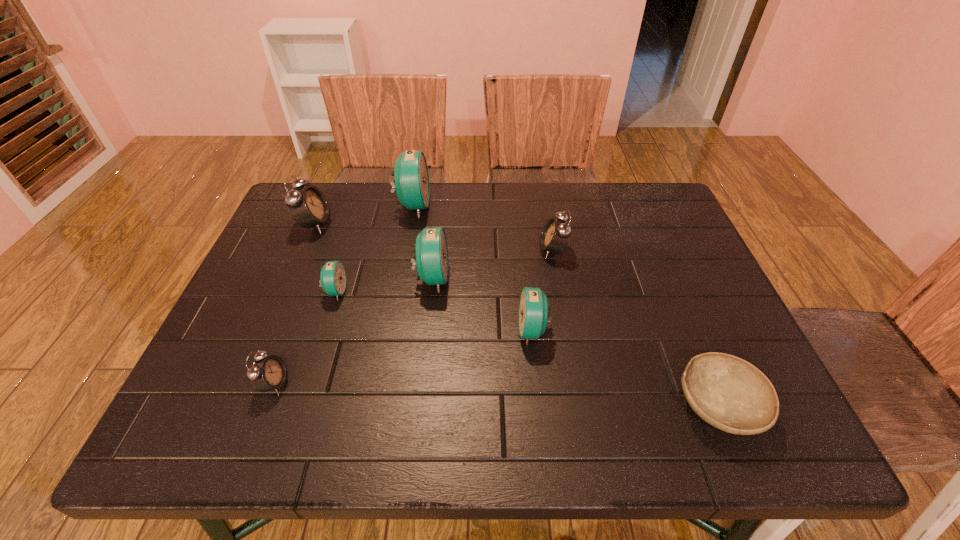
Image resolution: width=960 pixels, height=540 pixels. Find the location of `empty space between the gray bowl and the second biggest blue alarm clock`. empty space between the gray bowl and the second biggest blue alarm clock is located at coordinates (575, 342).

The width and height of the screenshot is (960, 540). I want to click on free space between the farthest white alarm clock and the second biggest blue alarm clock, so click(373, 251).

Where is `empty location between the nearest white alarm clock and the second alarm clock from right to left`? The image size is (960, 540). empty location between the nearest white alarm clock and the second alarm clock from right to left is located at coordinates (404, 357).

Locate an element on the screen. The height and width of the screenshot is (540, 960). vacant region between the rightmost alarm clock and the second nearest alarm clock is located at coordinates (542, 290).

The image size is (960, 540). In order to click on object that can be found as the third closest to the nearest alarm clock in this screenshot , I will do `click(308, 206)`.

Identify which object is the closest to the smallest white alarm clock. Please provide its 2D coordinates. Your answer should be formatted as a tuple, i.e. [(x, y)], where the tuple contains the x and y coordinates of a point satisfying the conditions above.

[(333, 280)]

Select which alarm clock appears as the fifth closest to the rightmost white alarm clock. Please provide its 2D coordinates. Your answer should be formatted as a tuple, i.e. [(x, y)], where the tuple contains the x and y coordinates of a point satisfying the conditions above.

[(308, 206)]

Identify which alarm clock is the fifth nearest to the third smallest blue alarm clock. Please provide its 2D coordinates. Your answer should be formatted as a tuple, i.e. [(x, y)], where the tuple contains the x and y coordinates of a point satisfying the conditions above.

[(308, 206)]

Locate which blue alarm clock is the second closest to the nearest white alarm clock. Please provide its 2D coordinates. Your answer should be formatted as a tuple, i.e. [(x, y)], where the tuple contains the x and y coordinates of a point satisfying the conditions above.

[(431, 251)]

Identify the location of blue alarm clock that stands as the second closest to the sixth alarm clock from left to right. The height and width of the screenshot is (540, 960). (411, 179).